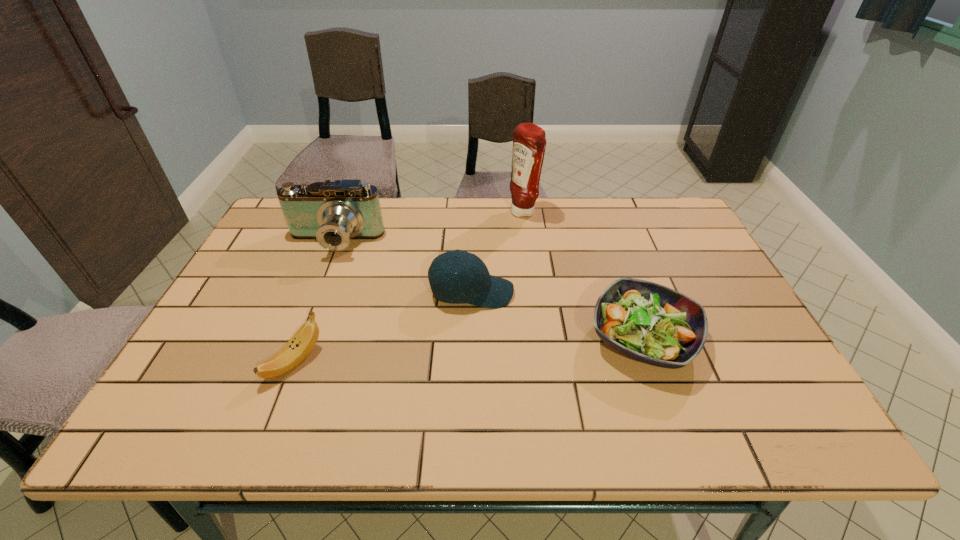
In order to click on blank area located 0.250m on the front-facing side of the third tallest object in this screenshot , I will do `click(608, 293)`.

Identify the location of blank area located on the right of the banana. The height and width of the screenshot is (540, 960). (491, 362).

The image size is (960, 540). In order to click on vacant space located on the back of the salad plate in this screenshot , I will do `click(604, 229)`.

This screenshot has width=960, height=540. Find the location of `condiment present at the far edge`. condiment present at the far edge is located at coordinates (529, 142).

Where is `camcorder that is at the far edge`? camcorder that is at the far edge is located at coordinates (333, 213).

I want to click on object that is at the left edge, so click(x=333, y=213).

Locate an element on the screen. This screenshot has width=960, height=540. object that is at the right edge is located at coordinates (648, 322).

The image size is (960, 540). What are the coordinates of `object present at the far left corner` in the screenshot? It's located at (333, 213).

What are the coordinates of `free point at the far edge` in the screenshot? It's located at click(615, 208).

Image resolution: width=960 pixels, height=540 pixels. What are the coordinates of `vacant space at the near edge of the desktop` in the screenshot? It's located at (253, 418).